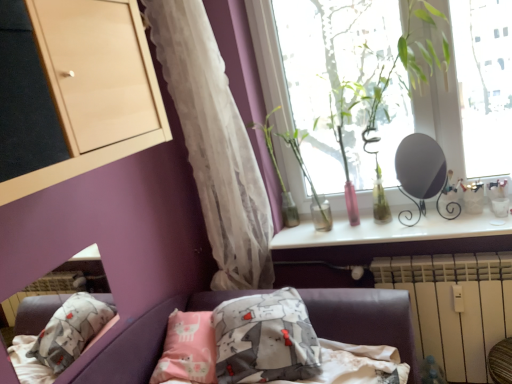
Question: Which direction should I rotate to look at green glass vase at upper center, which is the 1th plant in left-to-right order?

Choices:
 (A) left
 (B) right

Answer: (B)

Question: From the image's perspective, does white plastic radiator at lower right appear lower than green glass vase at upper center, which is the second plant in right-to-left order?

Choices:
 (A) yes
 (B) no

Answer: (A)

Question: Considering the relative sizes of white plastic radiator at lower right and green glass vase at upper center, which is the 1th plant in left-to-right order, in the image provided, is white plastic radiator at lower right smaller than green glass vase at upper center, which is the 1th plant in left-to-right order,?

Choices:
 (A) yes
 (B) no

Answer: (B)

Question: From a real-world perspective, is white plastic radiator at lower right positioned over green glass vase at upper center, which is the 1th plant in left-to-right order, based on gravity?

Choices:
 (A) no
 (B) yes

Answer: (A)

Question: Is white plastic radiator at lower right oriented towards green glass vase at upper center, which is the 1th plant in left-to-right order?

Choices:
 (A) no
 (B) yes

Answer: (A)

Question: Does white plastic radiator at lower right come behind green glass vase at upper center, which is the second plant in right-to-left order?

Choices:
 (A) no
 (B) yes

Answer: (A)

Question: Is white plastic radiator at lower right positioned far away from green glass vase at upper center, which is the second plant in right-to-left order?

Choices:
 (A) yes
 (B) no

Answer: (B)

Question: Does matte black mirror at upper right have a larger size compared to green glass vase at upper center, arranged as the 2th plant when viewed from the left?

Choices:
 (A) no
 (B) yes

Answer: (A)

Question: Does matte black mirror at upper right have a lesser height compared to green glass vase at upper center, which appears as the first plant when viewed from the right?

Choices:
 (A) yes
 (B) no

Answer: (A)

Question: Is matte black mirror at upper right in contact with green glass vase at upper center, which appears as the first plant when viewed from the right?

Choices:
 (A) no
 (B) yes

Answer: (A)

Question: From a real-world perspective, is matte black mirror at upper right on top of green glass vase at upper center, which appears as the first plant when viewed from the right?

Choices:
 (A) no
 (B) yes

Answer: (A)

Question: Can you confirm if matte black mirror at upper right is thinner than green glass vase at upper center, which appears as the first plant when viewed from the right?

Choices:
 (A) yes
 (B) no

Answer: (A)

Question: From a real-world perspective, is matte black mirror at upper right positioned under green glass vase at upper center, which appears as the first plant when viewed from the right, based on gravity?

Choices:
 (A) yes
 (B) no

Answer: (A)

Question: From the image's perspective, is green glass vase at upper center, which appears as the first plant when viewed from the right, under translucent white curtain at left?

Choices:
 (A) yes
 (B) no

Answer: (A)